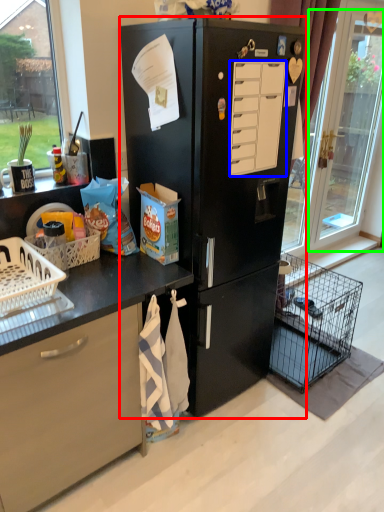
Question: Based on their relative distances, which object is farther from refrigerator (highlighted by a red box)? Choose from drawer (highlighted by a blue box) and glass door (highlighted by a green box).

Choices:
 (A) drawer
 (B) glass door

Answer: (B)